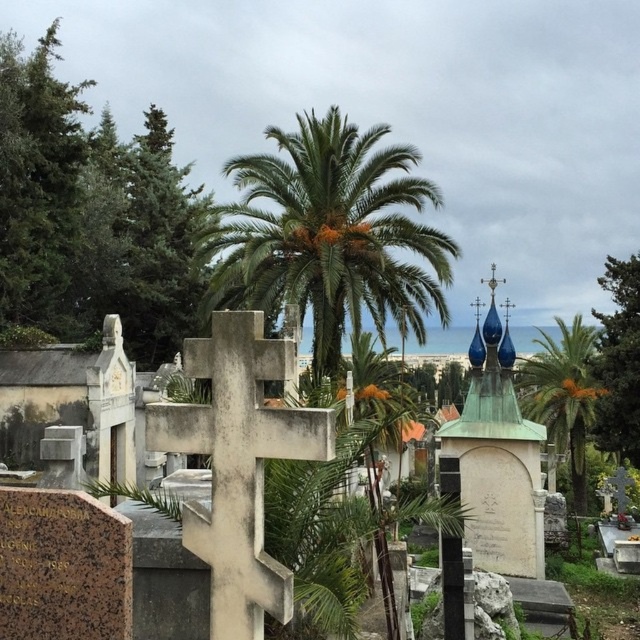
Question: Which object is the farthest from the metallic cross at upper center?

Choices:
 (A) green leafy tree at left
 (B) green leafy palm tree at center

Answer: (A)

Question: Estimate the real-world distances between objects in this image. Which object is farther from the white stone cross at center?

Choices:
 (A) metallic cross at upper center
 (B) green leafy palm at center
 (C) green leafy palm tree at center
 (D) green leafy tree at left

Answer: (C)

Question: Considering the relative positions of green leafy palm at center and white stone cross at center in the image provided, where is green leafy palm at center located with respect to white stone cross at center?

Choices:
 (A) below
 (B) above

Answer: (B)

Question: Does green leafy palm tree at center have a lesser width compared to green leafy tree at upper right?

Choices:
 (A) yes
 (B) no

Answer: (B)

Question: Which of these objects is positioned closest to the green leafy tree at upper right?

Choices:
 (A) green leafy tree at left
 (B) green leafy palm at center
 (C) white stone cross at center

Answer: (B)

Question: Does green leafy tree at left come behind white stone cross at center?

Choices:
 (A) no
 (B) yes

Answer: (B)